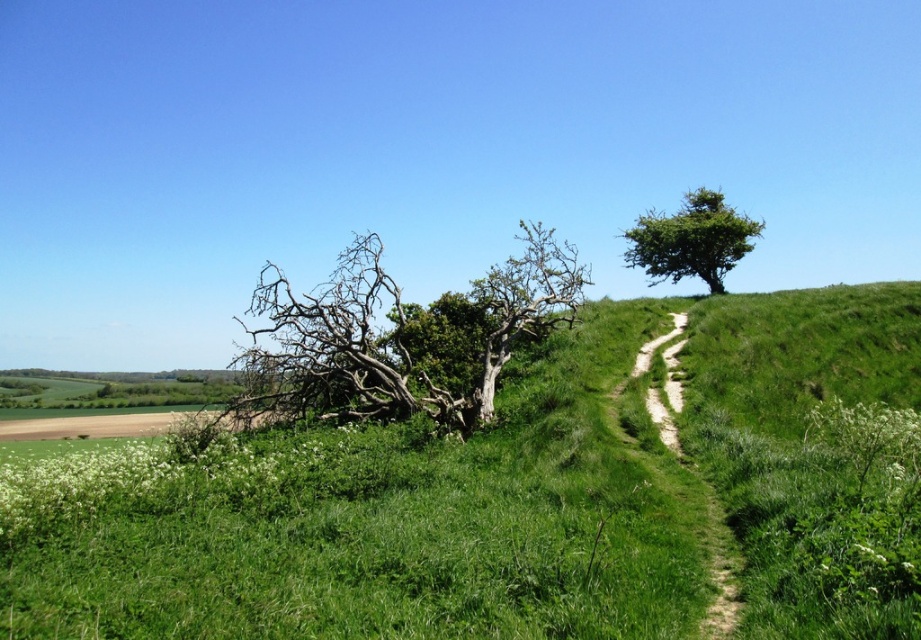
Who is positioned more to the right, bare wood tree at center-left or green leafy tree at upper right?

green leafy tree at upper right is more to the right.

Is bare wood tree at center-left closer to the viewer compared to green leafy tree at upper right?

Yes, it is in front of green leafy tree at upper right.

The height and width of the screenshot is (640, 921). I want to click on bare wood tree at center-left, so click(395, 337).

Can you confirm if green grassy hillside at center is positioned to the left of bare wood tree at center-left?

No, green grassy hillside at center is not to the left of bare wood tree at center-left.

Does green grassy hillside at center have a greater width compared to bare wood tree at center-left?

Indeed, green grassy hillside at center has a greater width compared to bare wood tree at center-left.

Is point (621, 435) closer to camera compared to point (286, 284)?

That is True.

The width and height of the screenshot is (921, 640). I want to click on green grassy hillside at center, so click(x=520, y=502).

Between green leafy tree at upper right and dirt path at center-right, which one is positioned higher?

green leafy tree at upper right is above.

Identify the location of green leafy tree at upper right. The width and height of the screenshot is (921, 640). (691, 241).